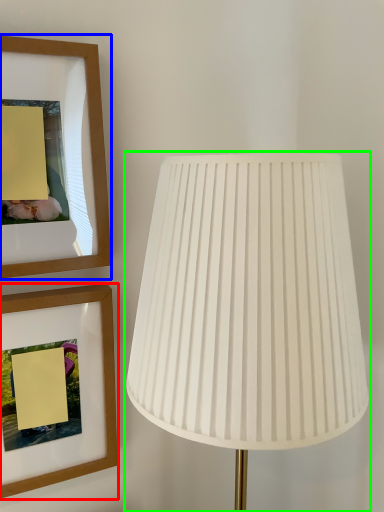
Question: Based on their relative distances, which object is farther from picture frame (highlighted by a red box)? Choose from picture frame (highlighted by a blue box) and lamp (highlighted by a green box).

Choices:
 (A) picture frame
 (B) lamp

Answer: (B)